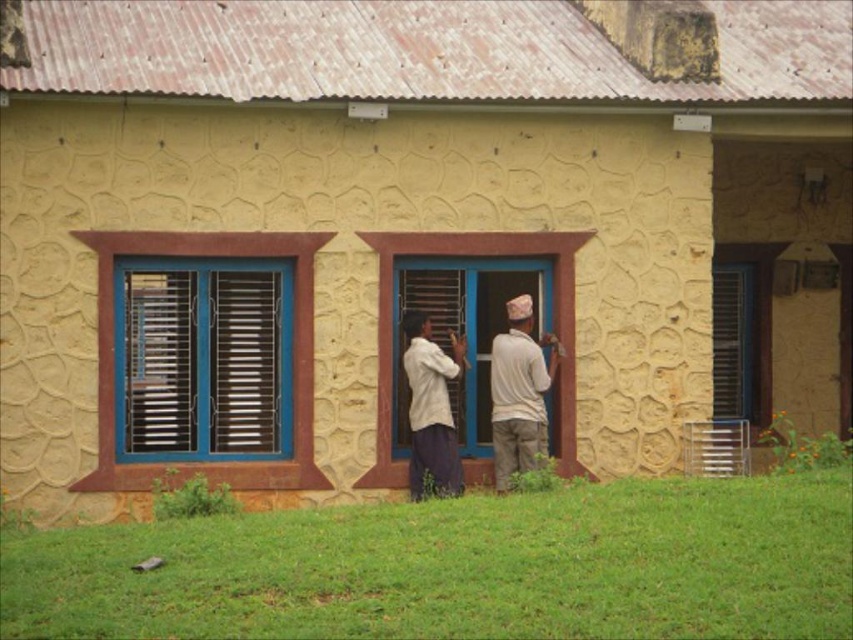
You are standing at the point with coordinates point (552, 348) and want to move towards the point with coordinates point (451, 380). According to the scene description, which direction should you move to get closer to your destination?

To move from point (552, 348) towards point (451, 380), you should move northeast since point (451, 380) is northeast of point (552, 348).

You are an observer looking at the building. Which object is wider, the light beige fabric shirt at center or the matte wood shutter at center?

The light beige fabric shirt at center is wider than the matte wood shutter at center.

You are standing in front of a building with two windows. You see a white cotton shirt at center and a matte wood shutter at center. Which object is closer to you?

The white cotton shirt at center is closer to the viewer than the matte wood shutter at center.